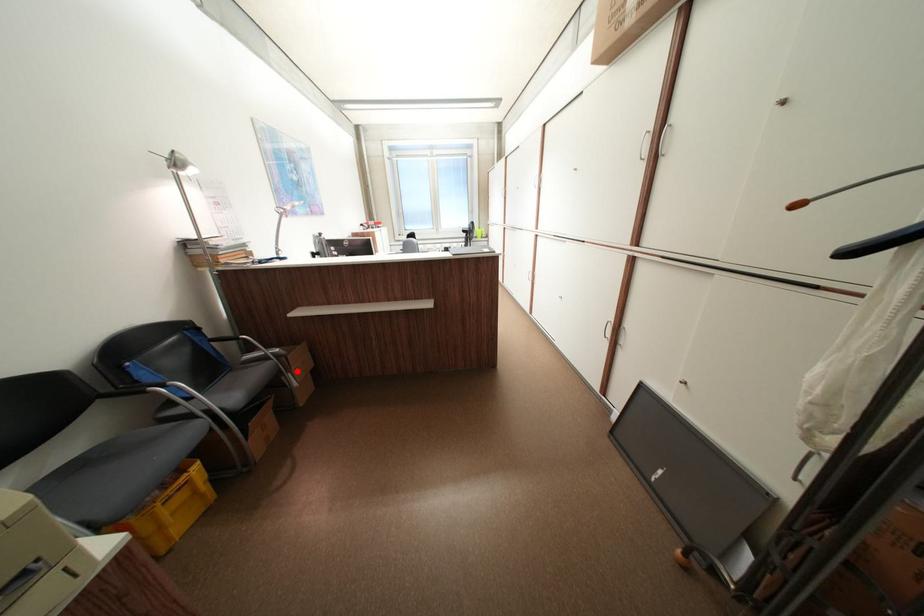
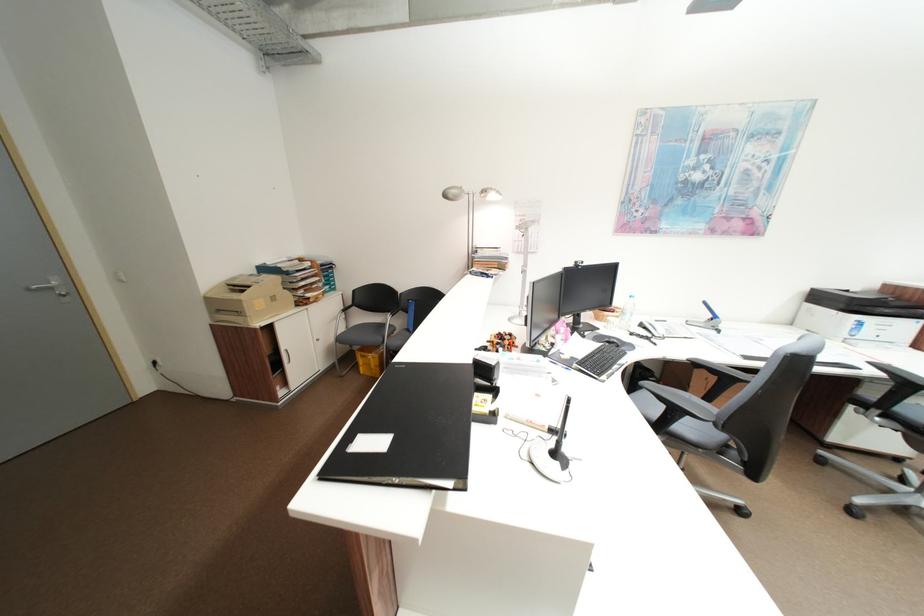
Question: I am providing you with two images of the same scene from different viewpoints. A red point is marked on the first image. Is the red point's position out of view in image 2?

Choices:
 (A) Yes
 (B) No

Answer: (A)